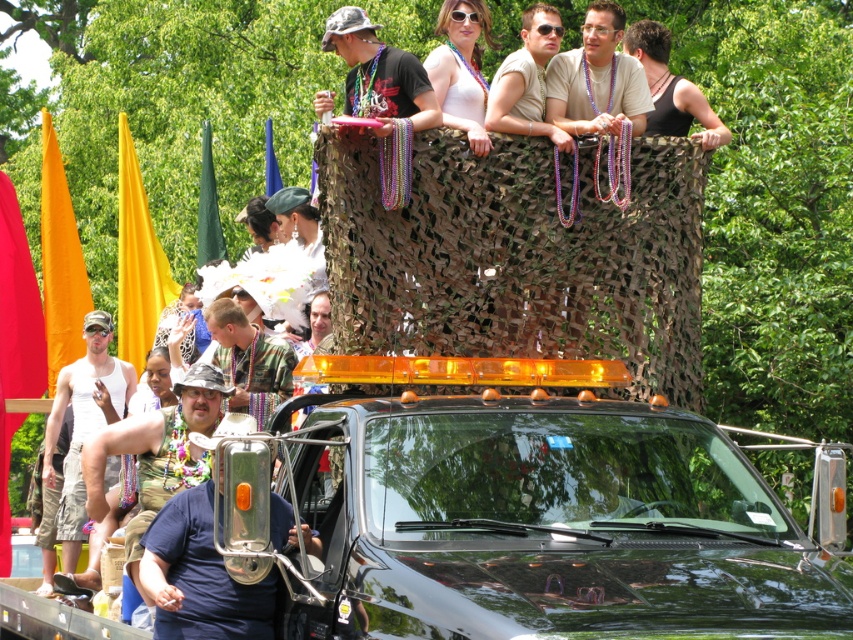
Can you confirm if brushed metal bell at center is positioned to the left of matte black sunglasses at upper center?

Indeed, brushed metal bell at center is positioned on the left side of matte black sunglasses at upper center.

Which is above, brushed metal bell at center or matte black sunglasses at upper center?

matte black sunglasses at upper center is above.

Between point (169, 544) and point (595, 129), which one is positioned behind?

The point (595, 129) is more distant.

Where is `brushed metal bell at center`? brushed metal bell at center is located at coordinates (200, 577).

Does point (105, 326) come in front of point (585, 100)?

No.

Does point (102, 353) come closer to viewer compared to point (641, 83)?

No, (102, 353) is further to viewer.

Where is `white matte tank top at center`? The height and width of the screenshot is (640, 853). white matte tank top at center is located at coordinates (83, 422).

Between matte black sunglasses at upper center and matte black t-shirt at upper center, which one has less height?

matte black sunglasses at upper center

Which is in front, point (592, 12) or point (366, 116)?

Point (366, 116)

Which is behind, point (582, 131) or point (410, 96)?

The point (410, 96) is behind.

You are a GUI agent. You are given a task and a screenshot of the screen. Output one action in this format:
    pyautogui.click(x=<x>, y=<y>)
    Task: Click on the matte black sunglasses at upper center
    This screenshot has width=853, height=640.
    Given the screenshot: What is the action you would take?
    pyautogui.click(x=596, y=80)